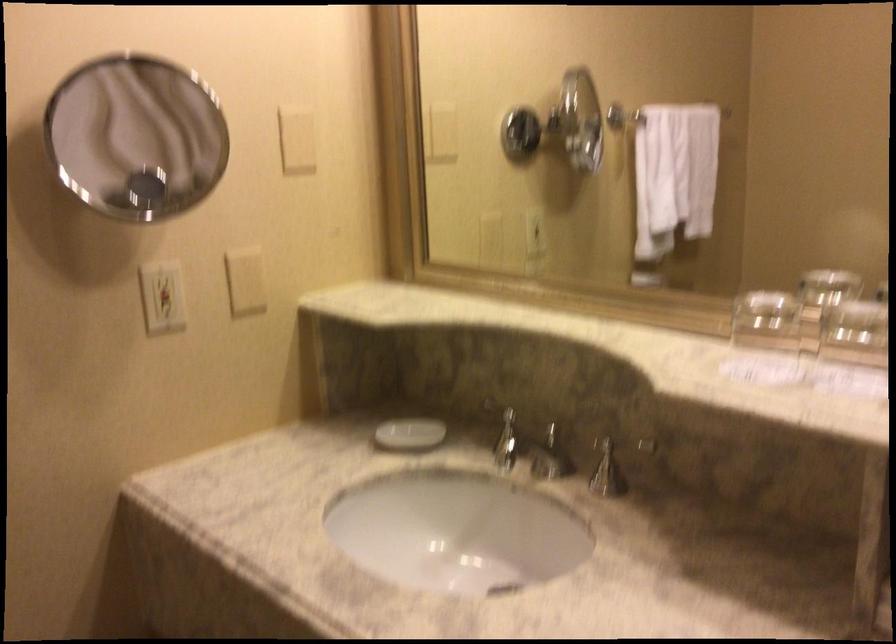
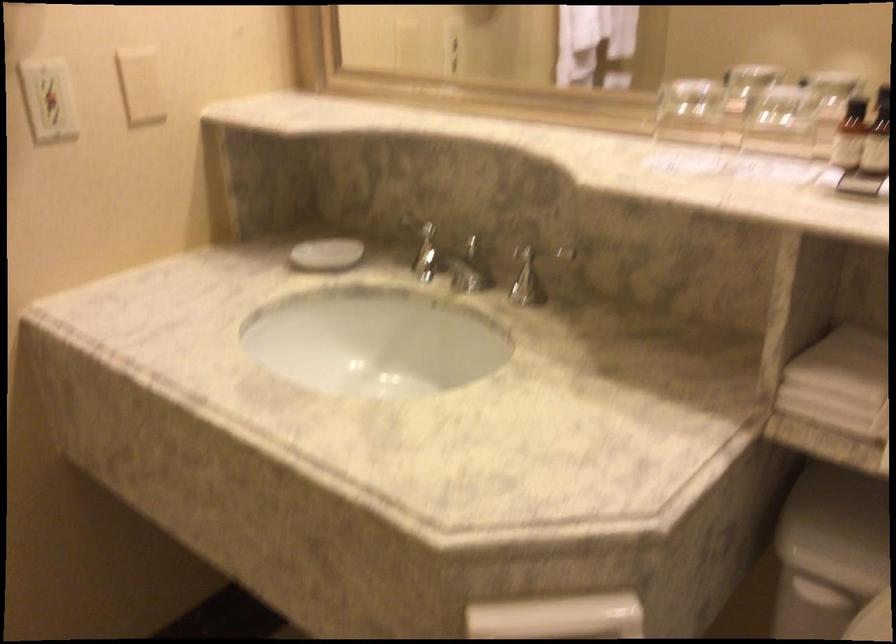
Locate, in the second image, the point that corresponds to the point at 167,289 in the first image.

(47, 99)